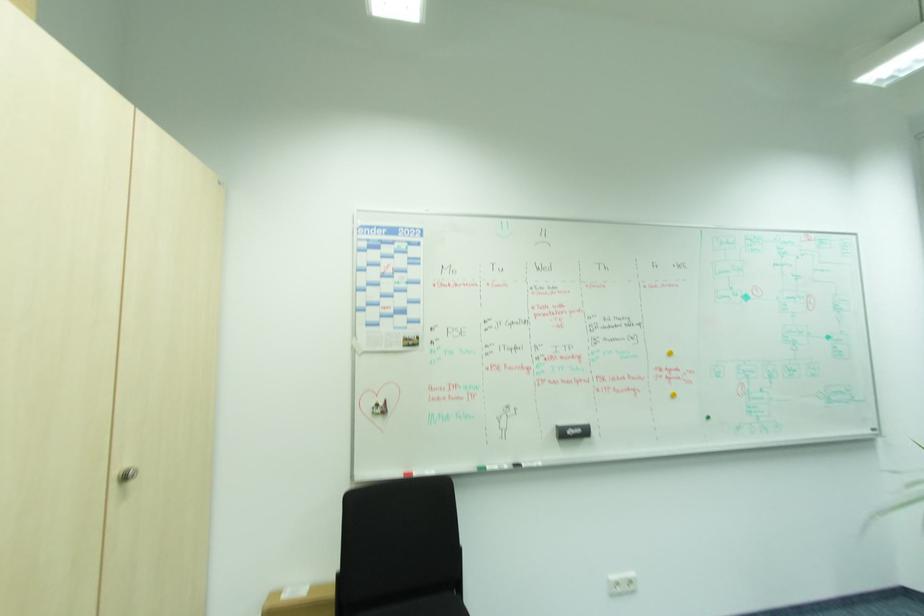
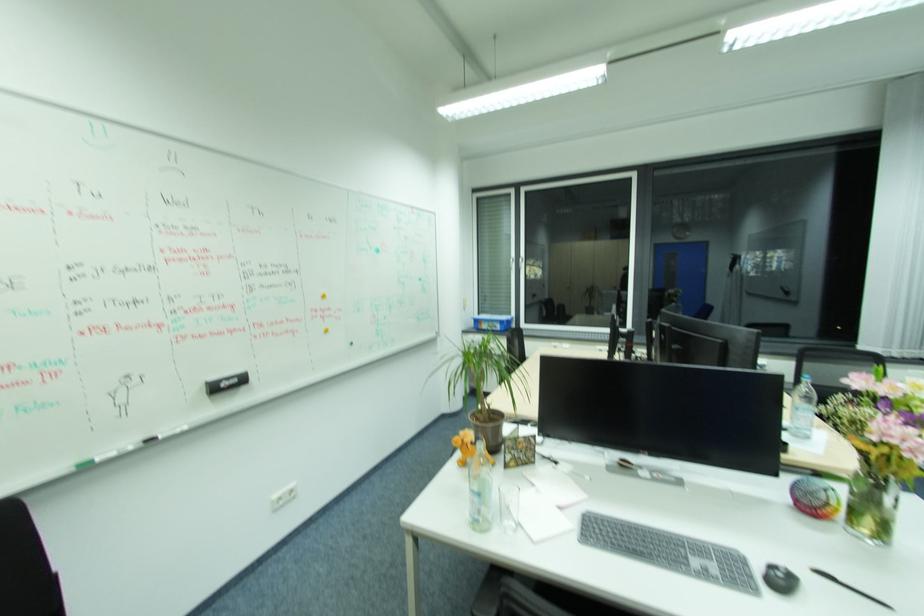
Where in the second image is the point corresponding to point 492,466 from the first image?

(105, 460)